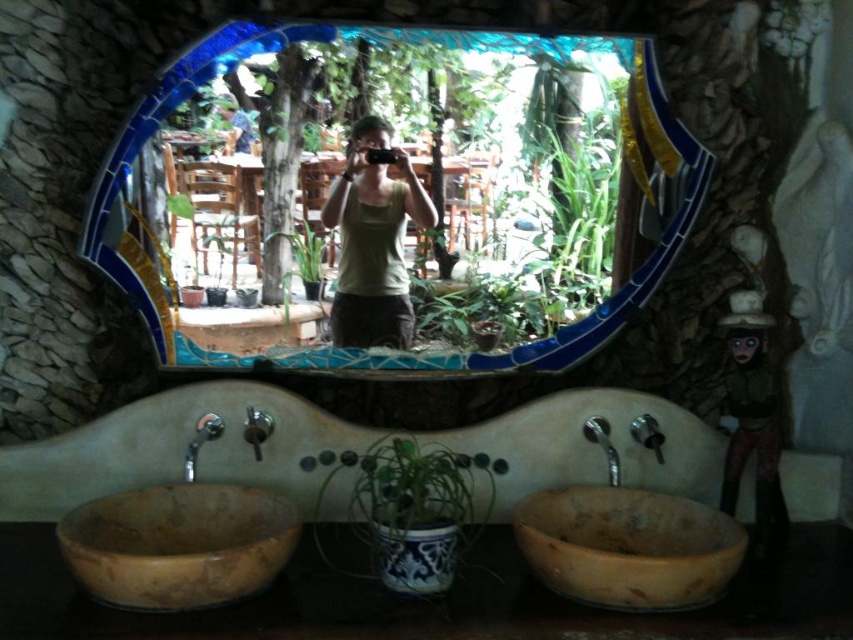
Question: Which object appears farthest from the camera in this image?

Choices:
 (A) natural wood sink at lower left
 (B) natural wood sink at lower right
 (C) blue mosaic mirror at center

Answer: (C)

Question: Is natural wood sink at lower right closer to the viewer compared to green matte tank top at center?

Choices:
 (A) yes
 (B) no

Answer: (A)

Question: Which object appears farthest from the camera in this image?

Choices:
 (A) silver metallic faucet at right
 (B) wooden figurine at right
 (C) blue mosaic mirror at center
 (D) green matte tank top at center

Answer: (D)

Question: Which point is farther to the camera?

Choices:
 (A) wooden figurine at right
 (B) blue mosaic mirror at center

Answer: (B)

Question: From the image, what is the correct spatial relationship of natural wood sink at lower right in relation to silver metallic faucet at lower left?

Choices:
 (A) below
 (B) above

Answer: (A)

Question: Observing the image, what is the correct spatial positioning of natural wood sink at lower right in reference to green matte tank top at center?

Choices:
 (A) above
 (B) below

Answer: (B)